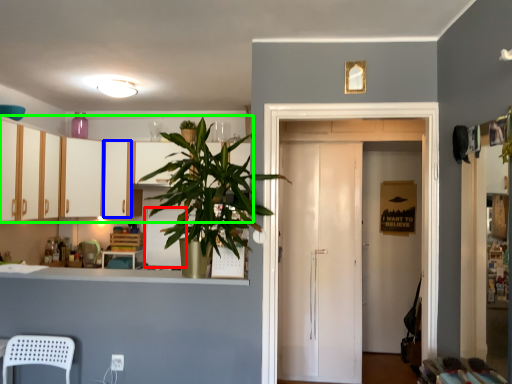
Question: Based on their relative distances, which object is nearer to appliance (highlighted by a red box)? Choose from cabinetry (highlighted by a blue box) and cabinetry (highlighted by a green box).

Choices:
 (A) cabinetry
 (B) cabinetry

Answer: (A)